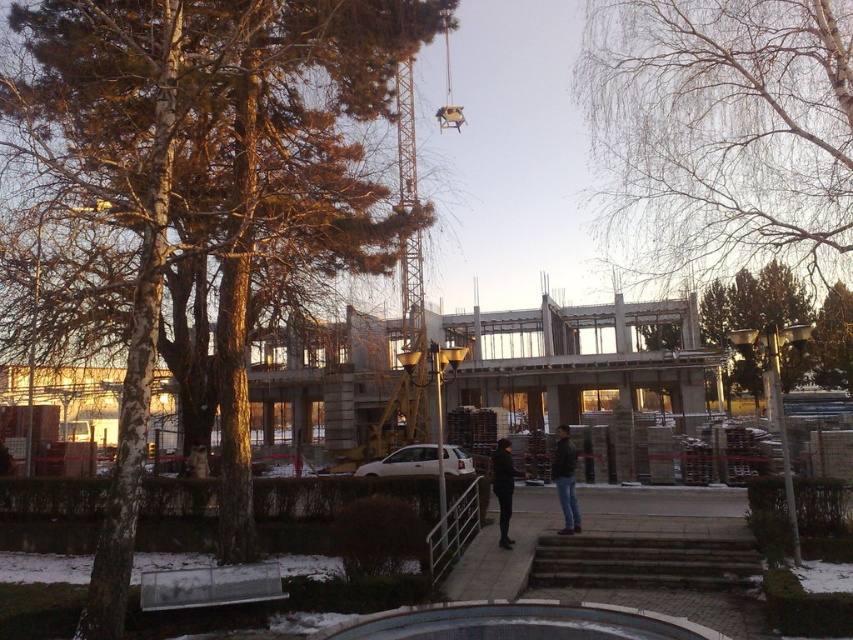
You are standing at the entrance of the construction site and see the brown textured tree at upper left and the bare branches at upper center. Which object is closer to the ground?

The brown textured tree at upper left is closer to the ground because it is positioned below the bare branches at upper center.

Looking at this image, you are standing at the base of the dark gray concrete stairs at center and want to reach the bare branches at upper center. Which direction should you move to get closer to the branches?

The bare branches at upper center are further to the viewer than the dark gray concrete stairs at center, so you should move forward away from the stairs to reach the branches.